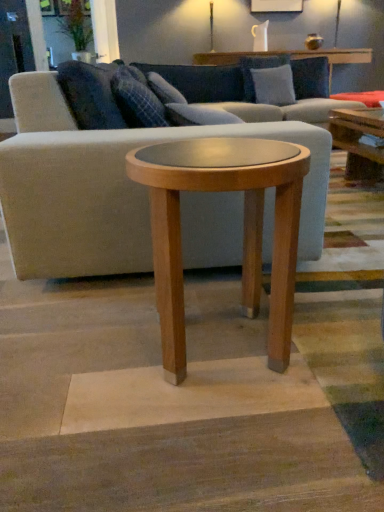
Identify the location of free spot in front of light brown wood side table at center. The image size is (384, 512). (216, 443).